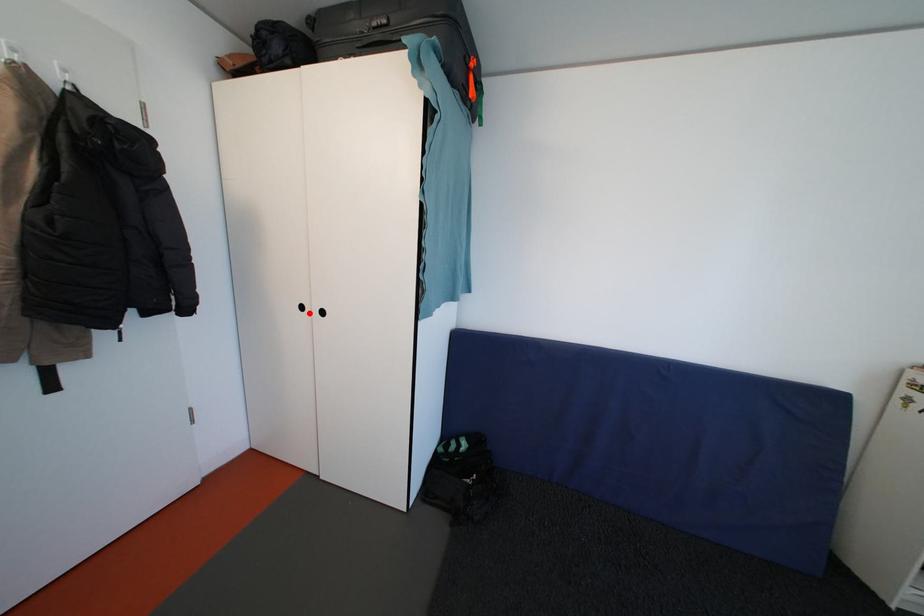
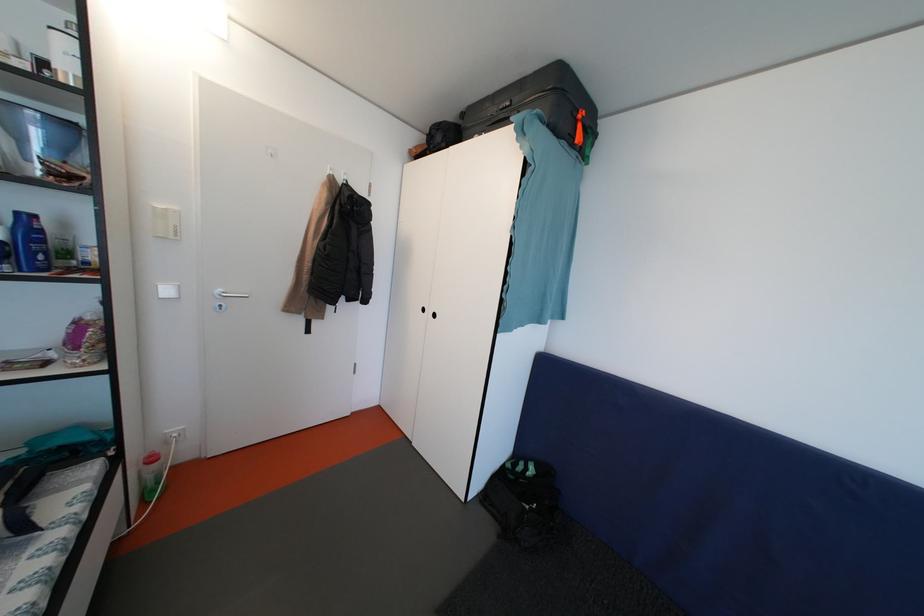
Find the pixel in the second image that matches the highlighted location in the first image.

(431, 315)